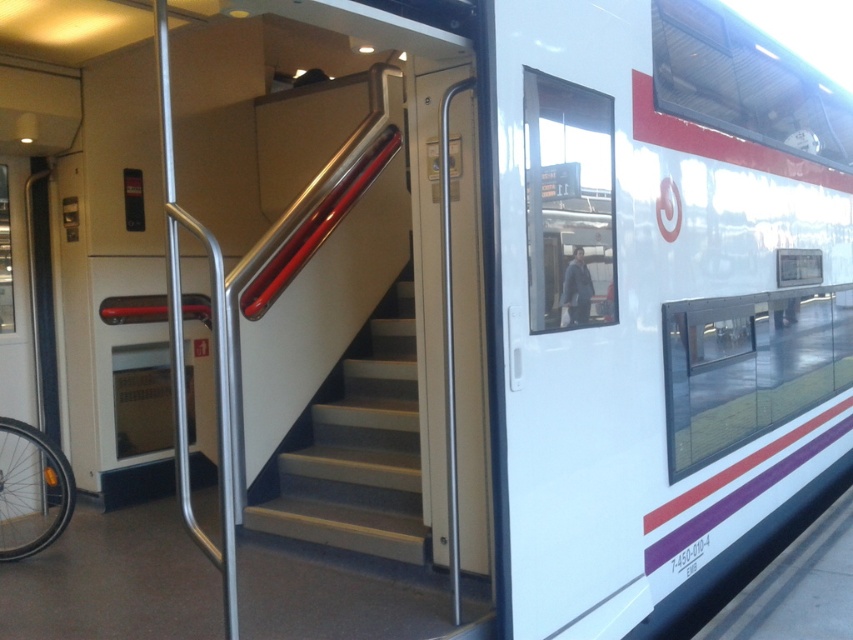
Does white matte stairs at center come in front of silver metallic bicycle wheel at lower left?

Yes, white matte stairs at center is in front of silver metallic bicycle wheel at lower left.

Can you confirm if white matte stairs at center is wider than silver metallic bicycle wheel at lower left?

Yes, white matte stairs at center is wider than silver metallic bicycle wheel at lower left.

The height and width of the screenshot is (640, 853). Identify the location of white matte stairs at center. (354, 449).